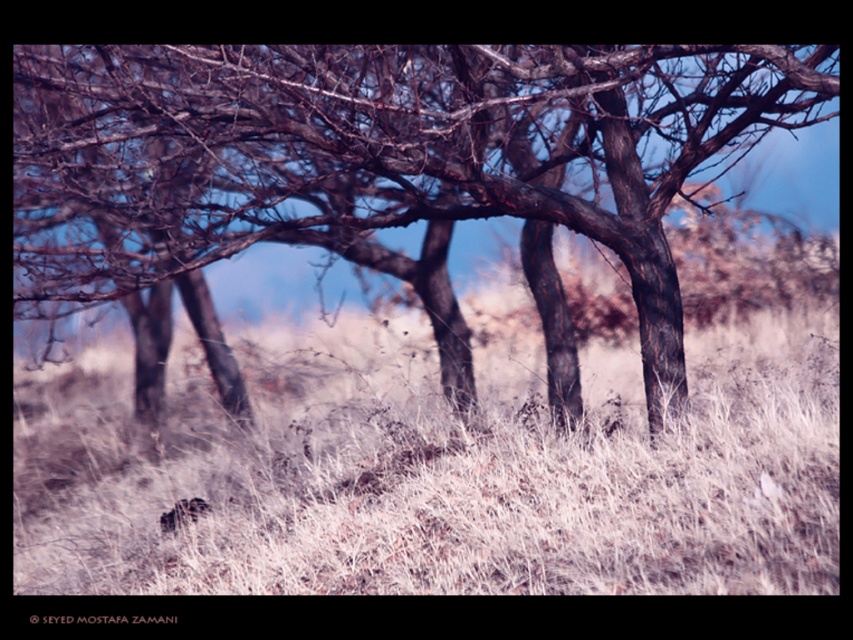
Between dry grass at center and brown bark tree at center, which one appears on the left side from the viewer's perspective?

brown bark tree at center

This screenshot has width=853, height=640. What do you see at coordinates (450, 483) in the screenshot?
I see `dry grass at center` at bounding box center [450, 483].

Who is more distant from viewer, (672,536) or (454,168)?

Point (454,168)

This screenshot has width=853, height=640. I want to click on dry grass at center, so click(x=450, y=483).